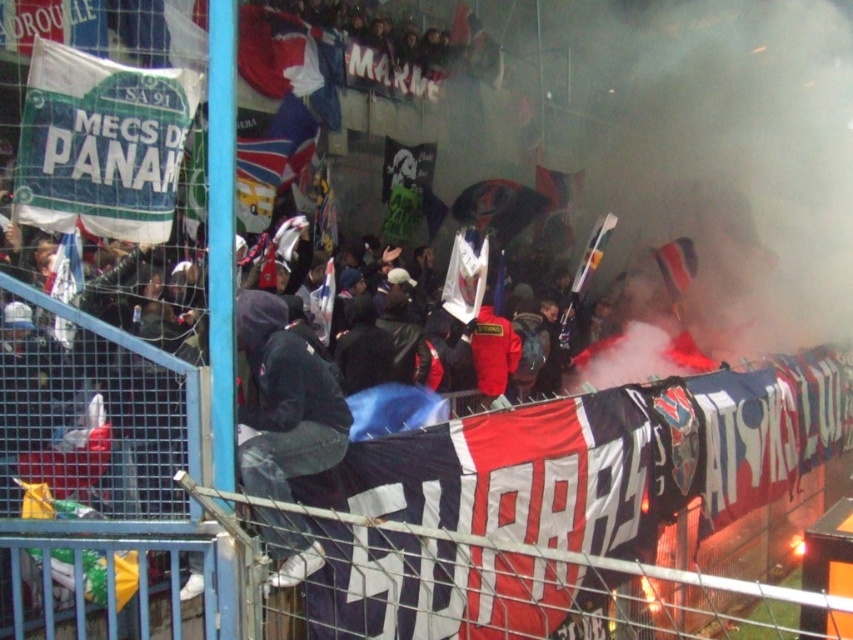
Question: Which object is farther from the camera taking this photo?

Choices:
 (A) dark gray hoodie at center
 (B) white fabric flag at left

Answer: (B)

Question: Which object is closer to the camera taking this photo?

Choices:
 (A) green fabric sign at upper left
 (B) red and white fabric banner at center

Answer: (A)

Question: Which of these objects is positioned closest to the green fabric sign at upper left?

Choices:
 (A) red and white fabric banner at center
 (B) white fabric flag at left

Answer: (B)

Question: Is green fabric sign at upper left positioned in front of white paper flag at center?

Choices:
 (A) no
 (B) yes

Answer: (B)

Question: Can you confirm if red and white fabric banner at center is smaller than green fabric sign at upper left?

Choices:
 (A) no
 (B) yes

Answer: (A)

Question: Does red and white fabric banner at center come behind green fabric sign at upper left?

Choices:
 (A) yes
 (B) no

Answer: (A)